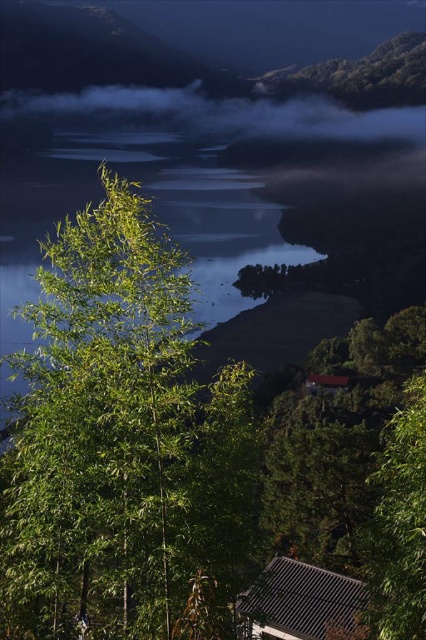
Question: Which of the following is the closest to the observer?

Choices:
 (A) green leafy tree at right
 (B) foggy mist at upper center

Answer: (A)

Question: Can you confirm if foggy mist at upper center is positioned to the right of gray corrugated metal hut at lower center?

Choices:
 (A) no
 (B) yes

Answer: (A)

Question: Among these points, which one is nearest to the camera?

Choices:
 (A) (422, 138)
 (B) (354, 593)

Answer: (B)

Question: Estimate the real-world distances between objects in this image. Which object is farther from the foggy mist at upper center?

Choices:
 (A) gray corrugated metal hut at lower center
 (B) green leafy tree at right
 (C) brown wooden hut at center-right

Answer: (B)

Question: Does gray corrugated metal hut at lower center appear on the left side of brown wooden hut at center-right?

Choices:
 (A) no
 (B) yes

Answer: (B)

Question: Does green leafy tree at right come in front of gray corrugated metal hut at lower center?

Choices:
 (A) no
 (B) yes

Answer: (B)